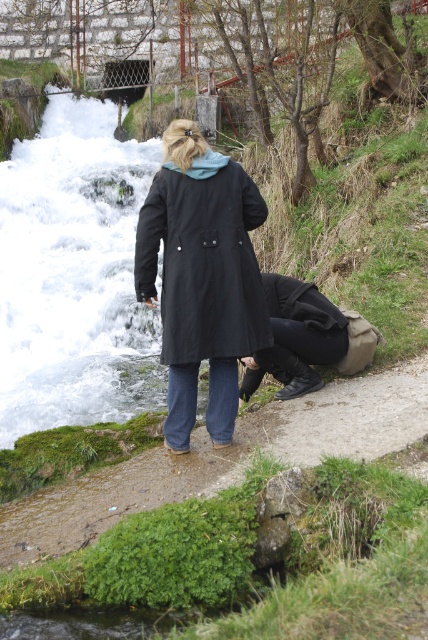
Where is `black matte coat at center`? This screenshot has width=428, height=640. black matte coat at center is located at coordinates (204, 260).

Between black matte coat at center and black fabric bag at lower center, which one has more height?

black matte coat at center

Which is behind, point (205, 176) or point (290, 380)?

The point (290, 380) is behind.

Identify the location of black matte coat at center. (204, 260).

Does mossy concrete path at lower center have a greater width compared to black fabric bag at lower center?

Yes.

Does point (305, 396) come farther from viewer compared to point (279, 344)?

That is True.

Is point (412, 388) positioned behind point (309, 372)?

That is False.

You are a GUI agent. You are given a task and a screenshot of the screen. Output one action in this format:
    pyautogui.click(x=<x>, y=<y>)
    Task: Click on the mossy concrete path at lower center
    The height and width of the screenshot is (640, 428).
    Given the screenshot: What is the action you would take?
    pyautogui.click(x=223, y=458)

Is mossy concrete path at lower center closer to camera compared to black matte coat at center?

Yes, it is.

Where is `mossy concrete path at lower center`? The height and width of the screenshot is (640, 428). mossy concrete path at lower center is located at coordinates (223, 458).

Identify the location of mossy concrete path at lower center. point(223,458).